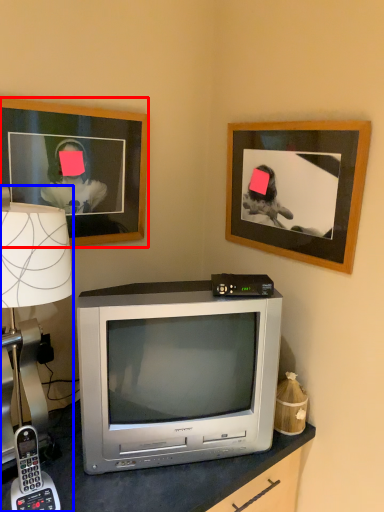
Question: Which object appears closest to the camera in this image, picture frame (highlighted by a red box) or lamp (highlighted by a blue box)?

Choices:
 (A) picture frame
 (B) lamp

Answer: (B)